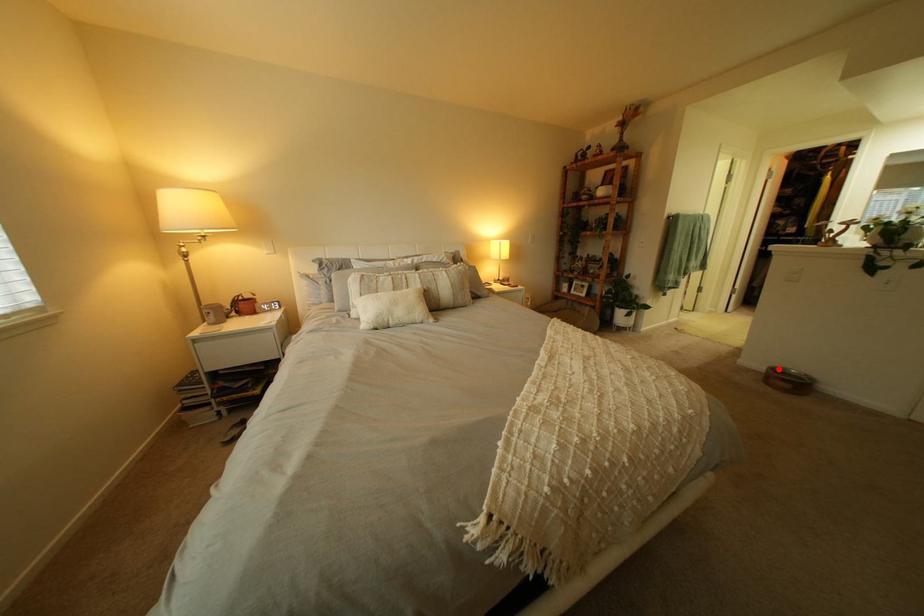
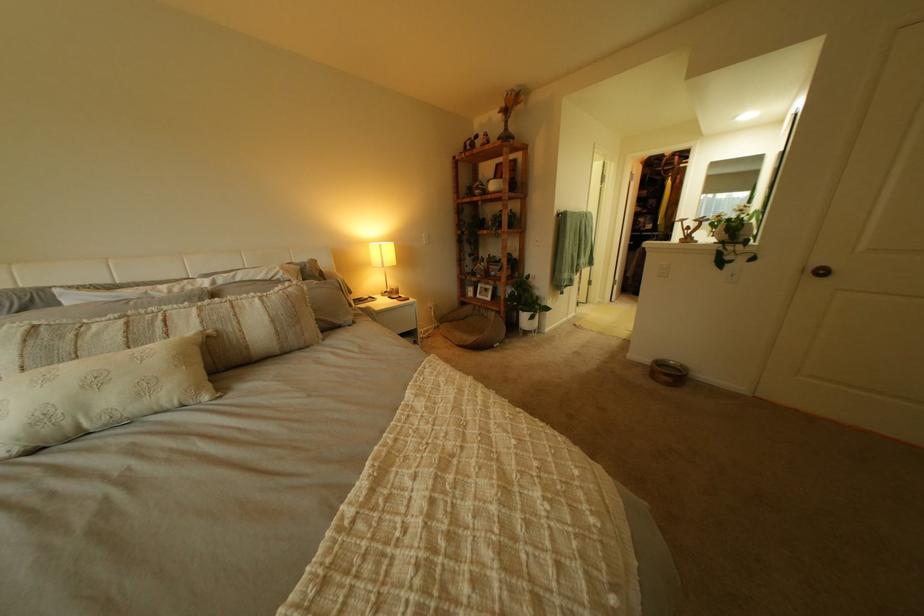
Question: I am providing you with two images of the same scene from different viewpoints. A red point is shown in image1. For the corresponding object point in image2, is it positioned nearer or farther from the camera?

Choices:
 (A) Nearer
 (B) Farther

Answer: (A)